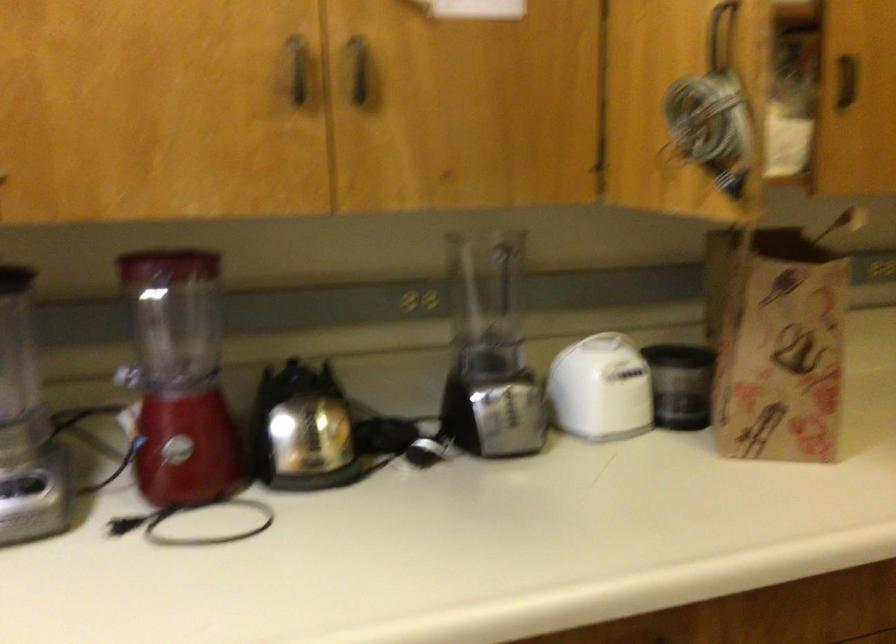
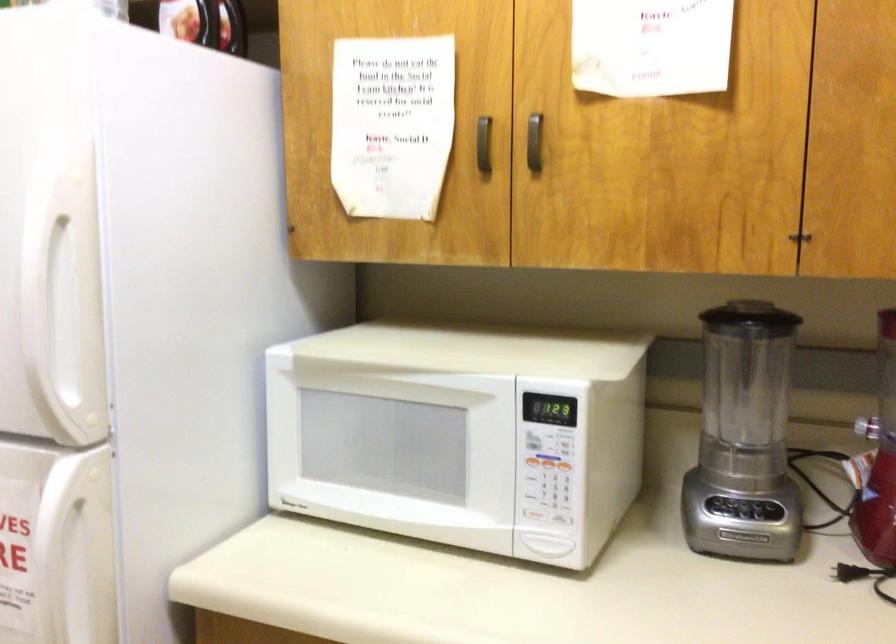
Question: The camera is either moving clockwise (left) or counter-clockwise (right) around the object. The first image is from the beginning of the video and the second image is from the end. Is the camera moving left or right when shooting the video?

Choices:
 (A) Left
 (B) Right

Answer: (B)